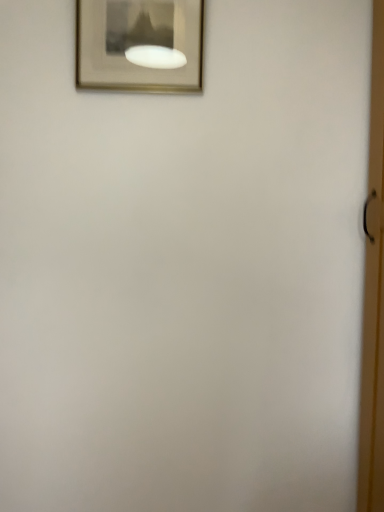
The height and width of the screenshot is (512, 384). What do you see at coordinates (140, 45) in the screenshot?
I see `metallic gold picture frame at upper center` at bounding box center [140, 45].

Locate an element on the screen. metallic gold picture frame at upper center is located at coordinates coord(140,45).

Where is `metallic gold picture frame at upper center`? This screenshot has height=512, width=384. metallic gold picture frame at upper center is located at coordinates (140, 45).